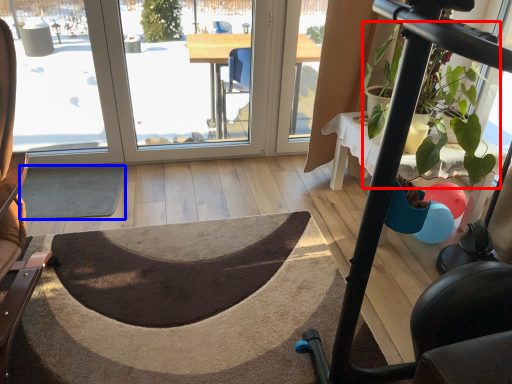
Question: Which point is further to the camera, plant (highlighted by a red box) or doormat (highlighted by a blue box)?

Choices:
 (A) plant
 (B) doormat

Answer: (B)